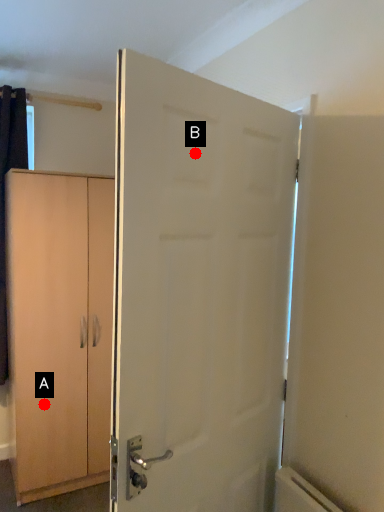
Question: Two points are circled on the image, labeled by A and B beside each circle. Among these points, which one is nearest to the camera?

Choices:
 (A) A is closer
 (B) B is closer

Answer: (B)